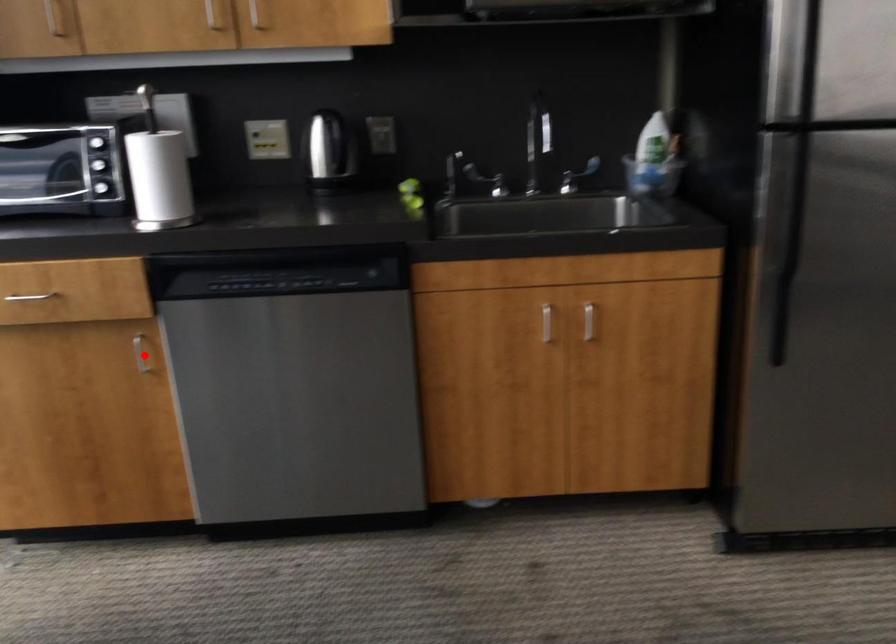
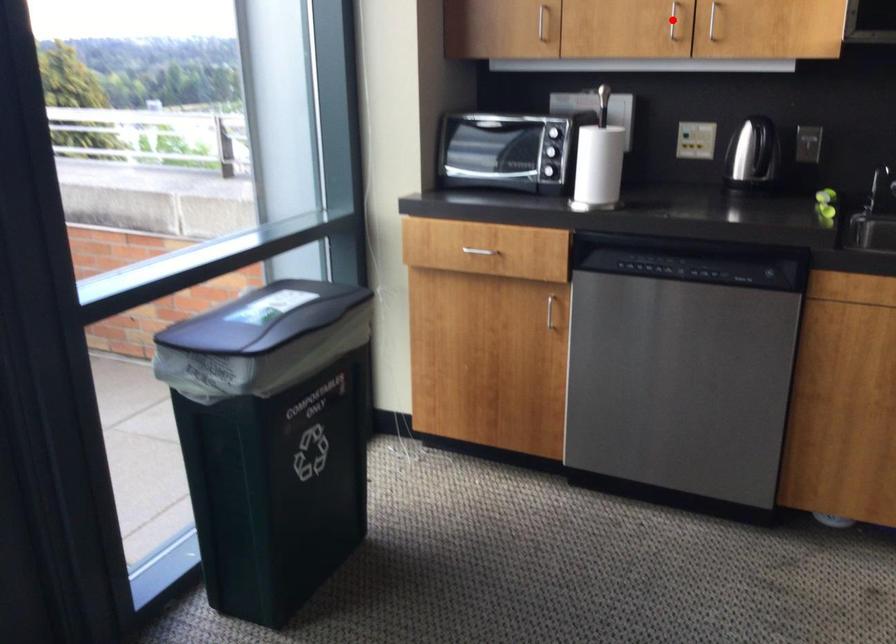
I am providing you with two images of the same scene from different viewpoints. A red point is marked on the first image and another point is marked on the second image. Does the point marked in image1 correspond to the same location as the one in image2?

No